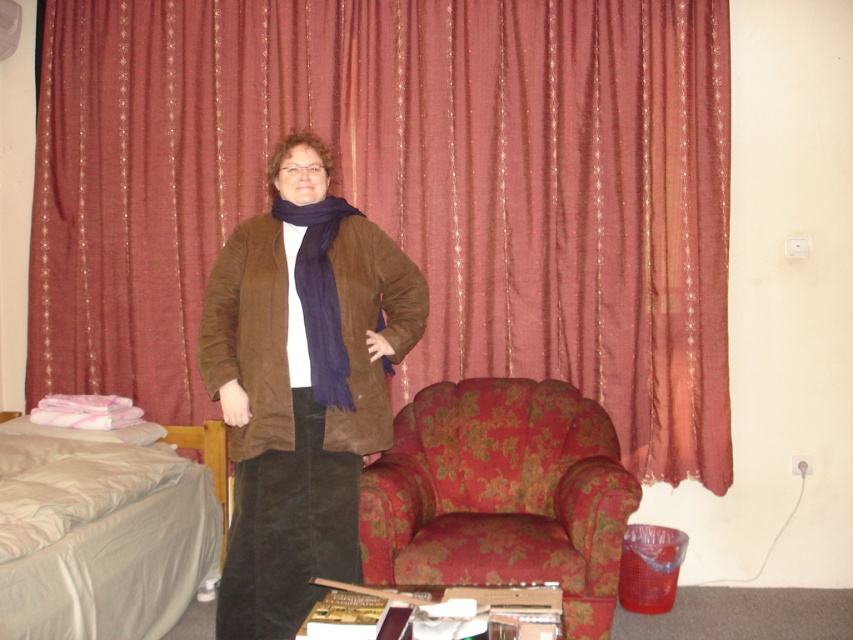
Does floral fabric armchair at lower center appear on the right side of light gray fabric bed at lower left?

Indeed, floral fabric armchair at lower center is positioned on the right side of light gray fabric bed at lower left.

Locate an element on the screen. floral fabric armchair at lower center is located at coordinates pyautogui.click(x=502, y=493).

Between point (454, 400) and point (373, 298), which one is positioned in front?

Point (373, 298)

Based on the photo, who is more distant from viewer, (x=465, y=502) or (x=358, y=268)?

Positioned behind is point (x=465, y=502).

Who is more distant from viewer, (554, 515) or (415, 301)?

Positioned behind is point (554, 515).

Locate an element on the screen. floral fabric armchair at lower center is located at coordinates (x=502, y=493).

From the picture: Who is more forward, (596, 349) or (372, 445)?

Positioned in front is point (372, 445).

Is point (291, 4) more distant than point (285, 356)?

Yes, it is behind point (285, 356).

Locate an element on the screen. Image resolution: width=853 pixels, height=640 pixels. maroon fabric curtain at upper center is located at coordinates (402, 189).